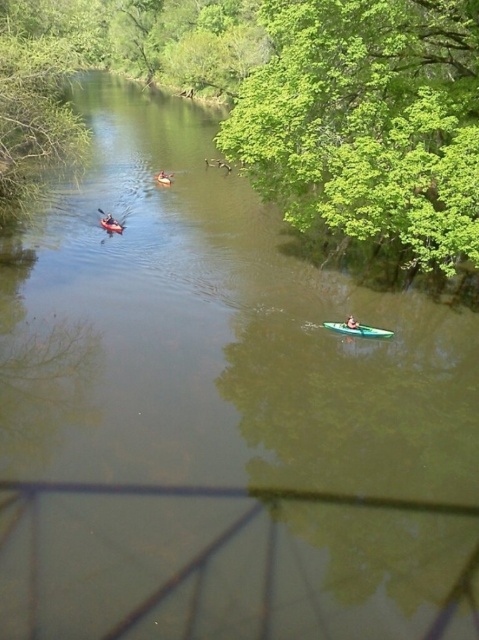
You are planning to take a short trip on the river and need a vessel that can carry more supplies. Based on the image, which one between the orange plastic canoe at center and the orange kayak at center would be more suitable for carrying more items?

The orange plastic canoe at center is larger in size compared to the orange kayak at center, making it more suitable for carrying more items.

You are a hiker trying to navigate to a green leafy tree at upper right. You are currently standing at point [368,122]. Can you see the green leafy tree at upper right from your current location?

Yes, you are already at the point where the green leafy tree at upper right is located, so you can see it clearly from your current location at point [368,122].

You are standing on the riverbank and want to take a photo of the orange kayak at center without the green leafy tree at upper right blocking the view. Is it possible to do so by moving your position along the bank?

The green leafy tree at upper right is above the orange kayak at center, so moving along the bank won t change their vertical positions. Therefore, the tree will still block the kayak in the photo.